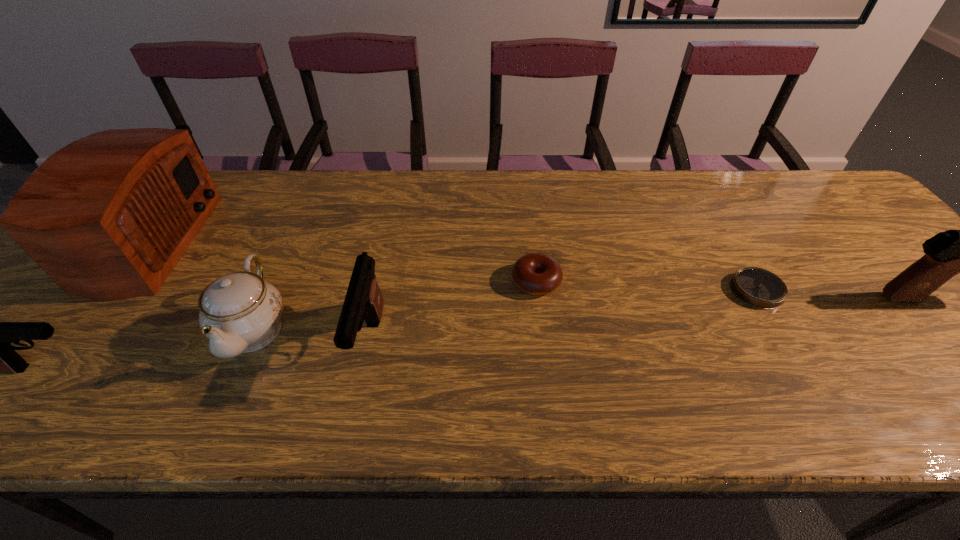
Identify the location of free space located 0.130m on the left of the second object from right to left. (676, 291).

The width and height of the screenshot is (960, 540). Find the location of `object that is at the far edge`. object that is at the far edge is located at coordinates (107, 217).

Identify the location of pistol at the near edge. (363, 300).

Locate an element on the screen. This screenshot has height=540, width=960. chinaware situated at the near edge is located at coordinates (239, 313).

Locate an element on the screen. object located at the left edge is located at coordinates (107, 217).

Where is `object positioned at the far left corner`? object positioned at the far left corner is located at coordinates (107, 217).

The width and height of the screenshot is (960, 540). In order to click on vacant space at the far edge of the desktop in this screenshot , I will do `click(570, 192)`.

The width and height of the screenshot is (960, 540). In the image, there is a desktop. What are the coordinates of `vacant region at the near edge` in the screenshot? It's located at click(133, 345).

Find the location of a particular element. This screenshot has width=960, height=540. vacant space at the left edge is located at coordinates (21, 292).

This screenshot has width=960, height=540. In order to click on blank space at the far right corner of the desktop in this screenshot , I will do `click(843, 193)`.